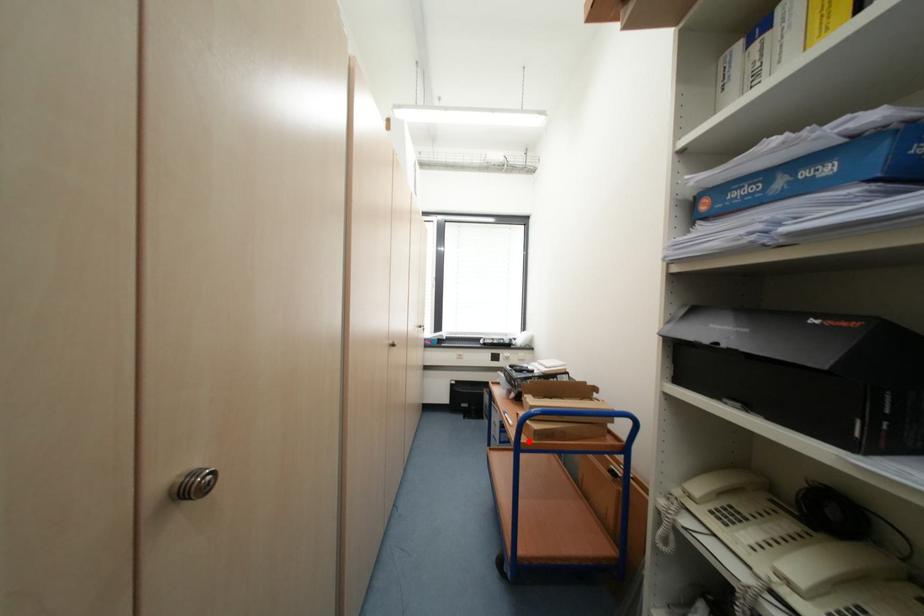
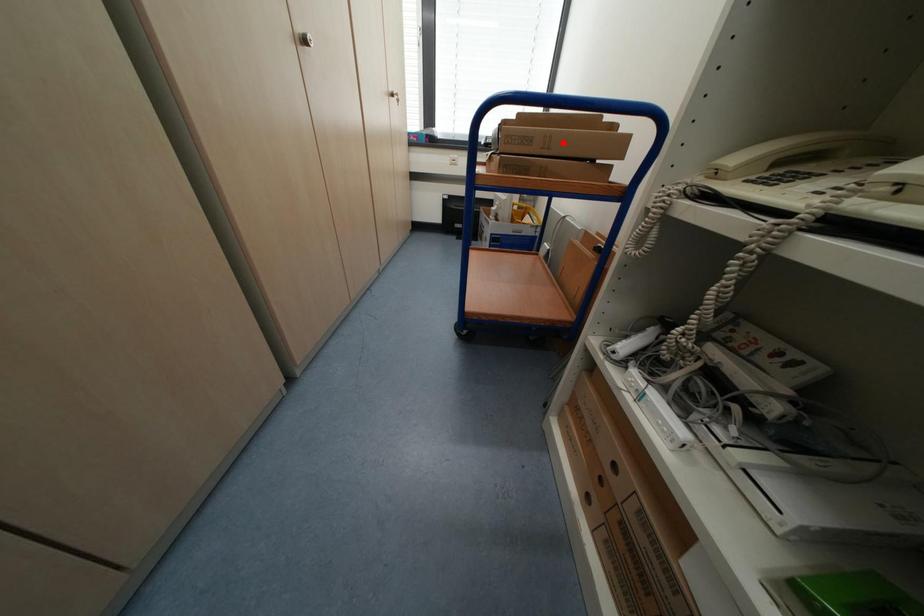
I am providing you with two images of the same scene from different viewpoints. A red point is marked on the first image and another point is marked on the second image. Is the red point in image1 aligned with the point shown in image2?

No